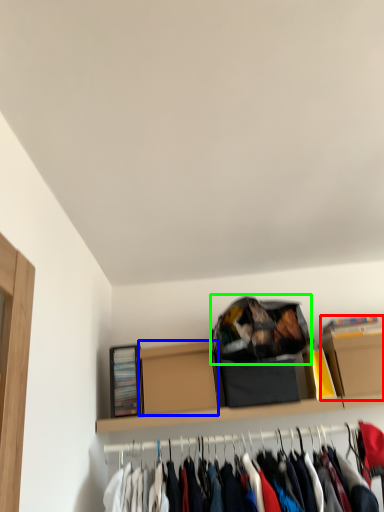
Question: Which object is the closest to the cardboard box (highlighted by a red box)? Choose among these: cardboard box (highlighted by a blue box) or bag (highlighted by a green box).

Choices:
 (A) cardboard box
 (B) bag

Answer: (B)